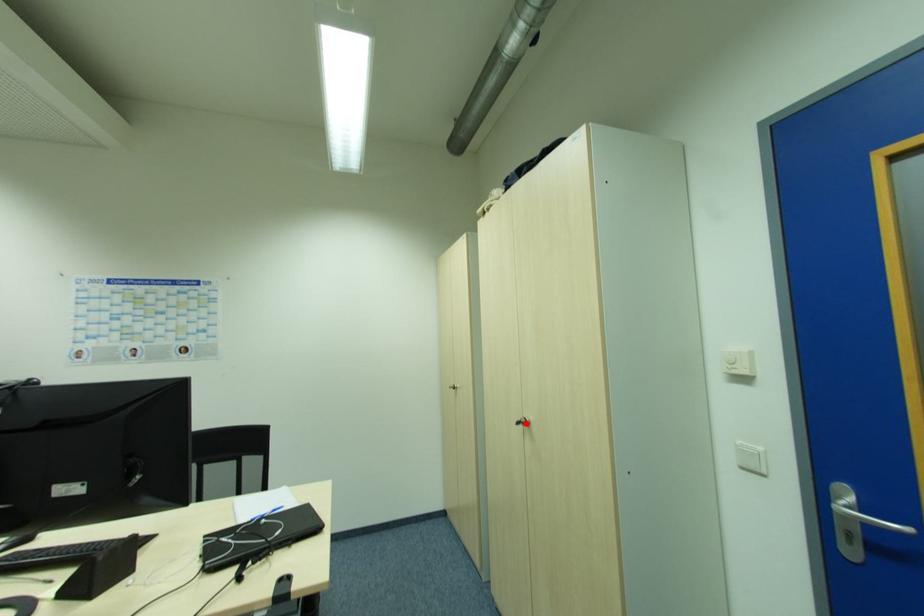
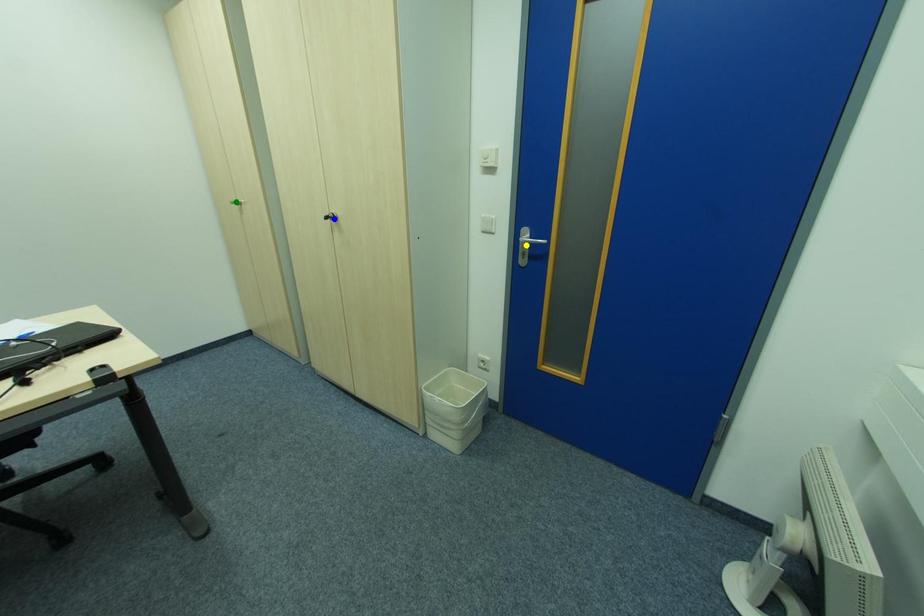
Question: I am providing you with two images of the same scene from different viewpoints. A red point is marked on the first image. You are given multiple points on the second image. Can you choose the point in image 2 that corresponds to the point in image 1?

Choices:
 (A) blue point
 (B) yellow point
 (C) green point

Answer: (A)